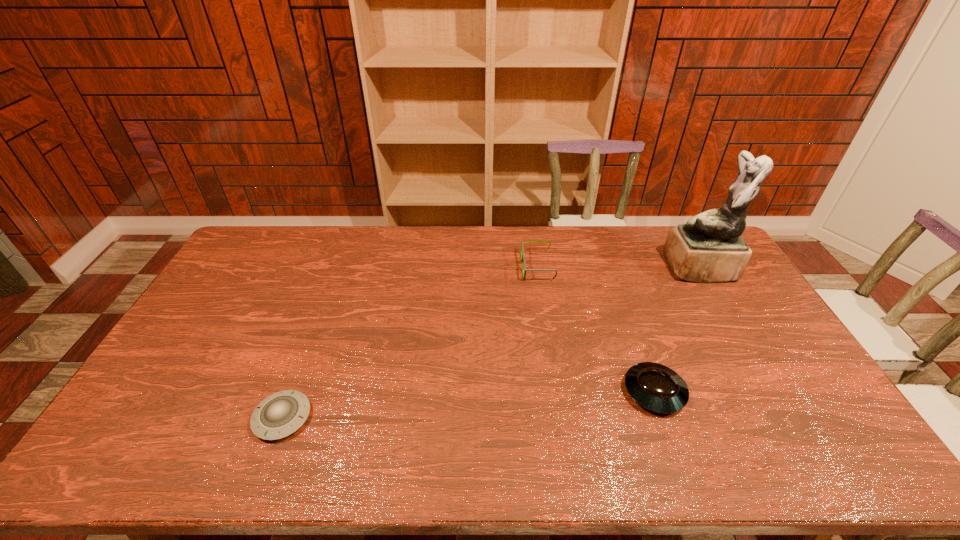
Where is `the tallest object`? The height and width of the screenshot is (540, 960). the tallest object is located at coordinates (709, 248).

Where is `sculpture`? Image resolution: width=960 pixels, height=540 pixels. sculpture is located at coordinates (709, 248).

The height and width of the screenshot is (540, 960). In order to click on the third object from right to left in this screenshot , I will do `click(522, 247)`.

Find the location of a particular element. The image size is (960, 540). the taller saucer is located at coordinates (x=655, y=387).

Locate an element on the screen. This screenshot has height=540, width=960. the third object from left to right is located at coordinates [655, 387].

Find the location of a particular element. This screenshot has height=540, width=960. the left saucer is located at coordinates (279, 415).

Identify the location of the leftmost object. Image resolution: width=960 pixels, height=540 pixels. (279, 415).

Identify the location of vacant space located 0.210m in a relaxed pose on the tallest object. (610, 268).

What are the coordinates of `blank space located in a relaxed pose on the tallest object` in the screenshot? It's located at (557, 268).

You are a GUI agent. You are given a task and a screenshot of the screen. Output one action in this format:
    pyautogui.click(x=<x>, y=<y>)
    Task: Click on the free space located 0.200m in a relaxed pose on the tallest object
    The image size is (960, 540).
    Given the screenshot: What is the action you would take?
    pyautogui.click(x=612, y=268)